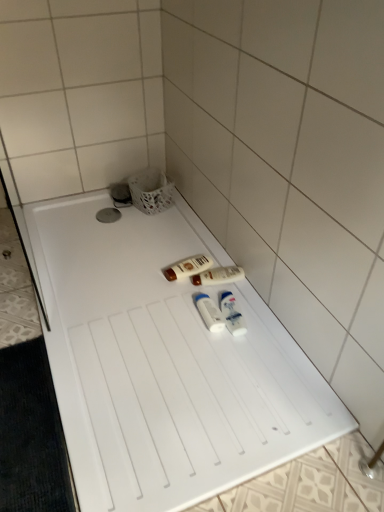
Find the location of a particular element. vacant region to the right of white plastic bottles at center, the fourth toiletry positioned from the back is located at coordinates (259, 324).